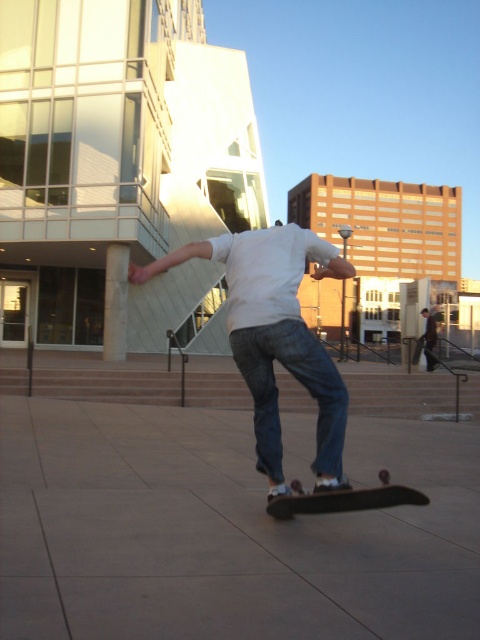
Question: In this image, where is white cotton shirt at center located relative to concrete stairs at center?

Choices:
 (A) below
 (B) above

Answer: (B)

Question: Among these objects, which one is farthest from the camera?

Choices:
 (A) concrete stairs at center
 (B) black matte skateboard at center

Answer: (A)

Question: Is white cotton shirt at center positioned before concrete stairs at center?

Choices:
 (A) no
 (B) yes

Answer: (B)

Question: Among these objects, which one is nearest to the camera?

Choices:
 (A) gray concrete pavement at center
 (B) dark brown leather jacket at center
 (C) black matte skateboard at center

Answer: (A)

Question: Does white cotton shirt at center appear under concrete stairs at center?

Choices:
 (A) no
 (B) yes

Answer: (A)

Question: Which point appears closest to the camera in this image?

Choices:
 (A) (168, 374)
 (B) (277, 497)
 (C) (427, 317)
 (D) (214, 252)

Answer: (D)